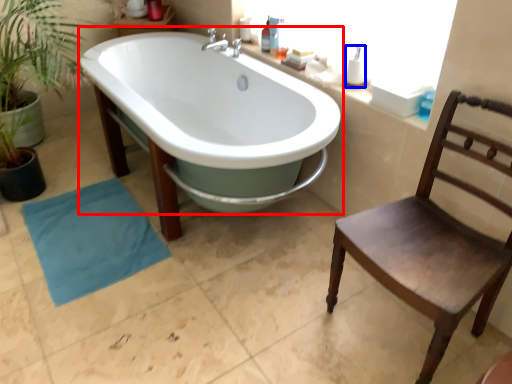
Question: Which point is closer to the camera, bathtub (highlighted by a red box) or toiletry (highlighted by a blue box)?

Choices:
 (A) bathtub
 (B) toiletry

Answer: (A)